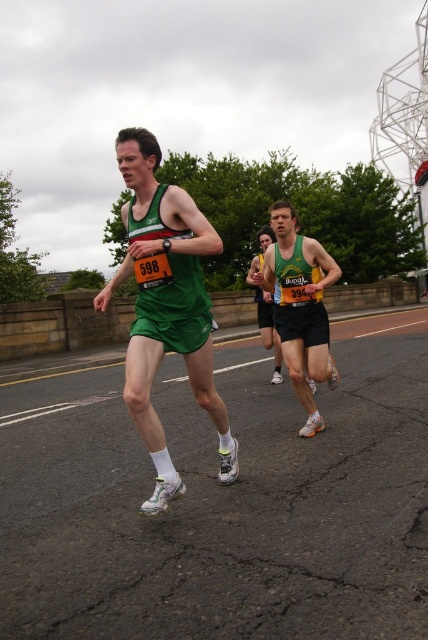
You are a photographer at the marathon event. You want to capture a photo of both the green fabric tank top at center and the green fabric running outfit at center. However, you notice that one is blocking the other. Which one should you adjust your camera angle to focus on first to ensure both are visible?

The green fabric tank top at center is positioned over the green fabric running outfit at center, so you should adjust your camera angle to focus on the green fabric running outfit at center first to ensure both are visible.

You are a photographer at the marathon event. You want to take a photo that includes both the green fabric tank top at center and the green fabric running outfit at center. Which object should you position closer to the camera to ensure both are fully visible in the frame?

The green fabric tank top at center is wider than the green fabric running outfit at center, so positioning the tank top closer to the camera will allow both to fit within the frame while maintaining visibility.